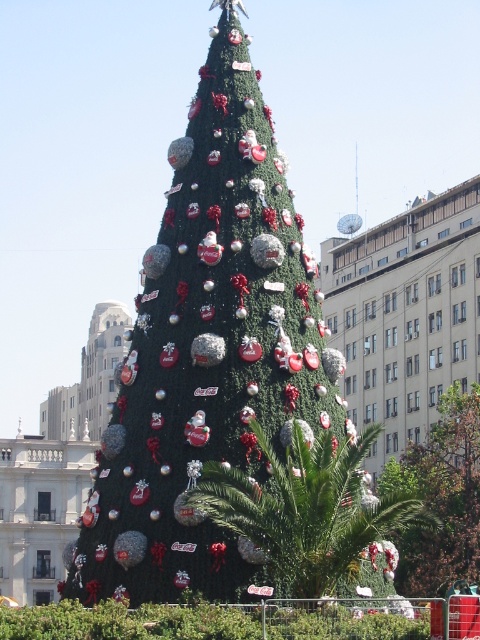
You are standing in the plaza and want to take a photo of the green leafy palm tree at center. Where should you position yourself to capture it in the frame?

The green leafy palm tree at center is located at coordinates approximately 0.795 on the x axis and 0.637 on the y axis, so you should position yourself facing that point to capture it in the frame.

Consider the image. You are standing in the public square and see the green leafy palm tree at center and the green matte christmas tree at center. Which one is closer to you?

The green leafy palm tree at center is closer to you since it is in front of the green matte christmas tree at center.